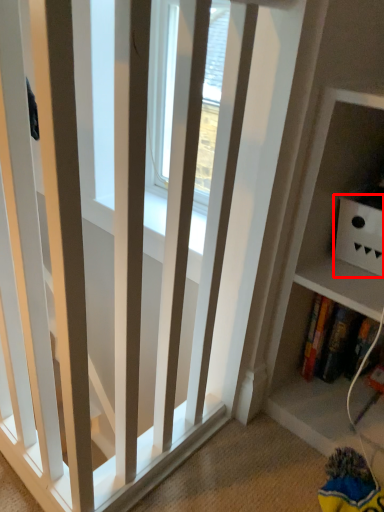
Question: From the image, what is the correct spatial relationship of cabinet (annotated by the red box) in relation to book?

Choices:
 (A) left
 (B) right

Answer: (B)